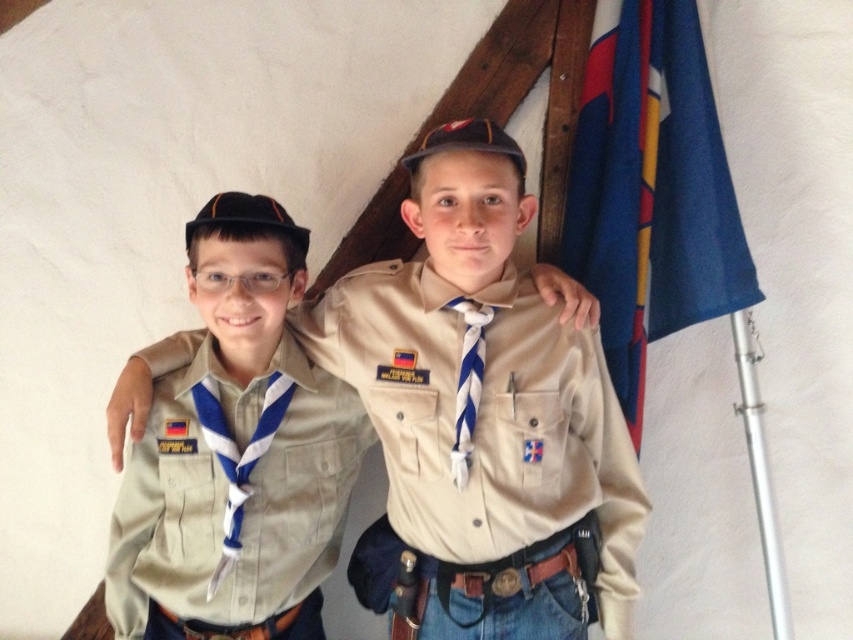
Between tan fabric shirt at center and blue fabric flag at upper right, which one has more height?

blue fabric flag at upper right

Who is positioned more to the left, tan fabric shirt at center or blue fabric flag at upper right?

From the viewer's perspective, tan fabric shirt at center appears more on the left side.

What do you see at coordinates (225, 492) in the screenshot?
I see `tan fabric shirt at center` at bounding box center [225, 492].

This screenshot has width=853, height=640. Find the location of `tan fabric shirt at center`. tan fabric shirt at center is located at coordinates (225, 492).

Can you confirm if tan fabric uniform at center is positioned to the right of blue fabric flag at upper right?

Incorrect, tan fabric uniform at center is not on the right side of blue fabric flag at upper right.

Is tan fabric uniform at center positioned in front of blue fabric flag at upper right?

Yes, it is in front of blue fabric flag at upper right.

The height and width of the screenshot is (640, 853). What are the coordinates of `tan fabric uniform at center` in the screenshot? It's located at (485, 420).

Locate an element on the screen. The height and width of the screenshot is (640, 853). tan fabric uniform at center is located at coordinates (485, 420).

Who is taller, tan fabric uniform at center or tan fabric shirt at center?

tan fabric uniform at center is taller.

At what (x,y) coordinates should I click in order to perform the action: click on tan fabric uniform at center. Please return your answer as a coordinate pair (x, y). Looking at the image, I should click on (485, 420).

The image size is (853, 640). Find the location of `tan fabric uniform at center`. tan fabric uniform at center is located at coordinates (485, 420).